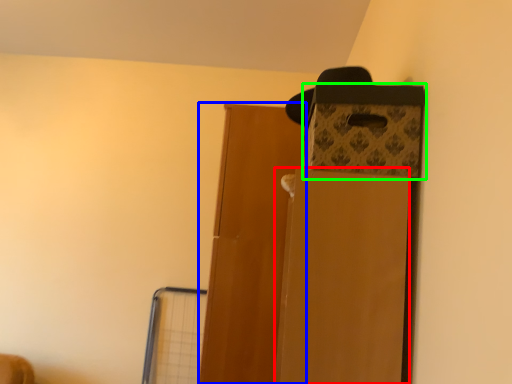
Question: Estimate the real-world distances between objects in this image. Which object is farther from cardboard box (highlighted by a red box), door (highlighted by a blue box) or storage box (highlighted by a green box)?

Choices:
 (A) door
 (B) storage box

Answer: (A)